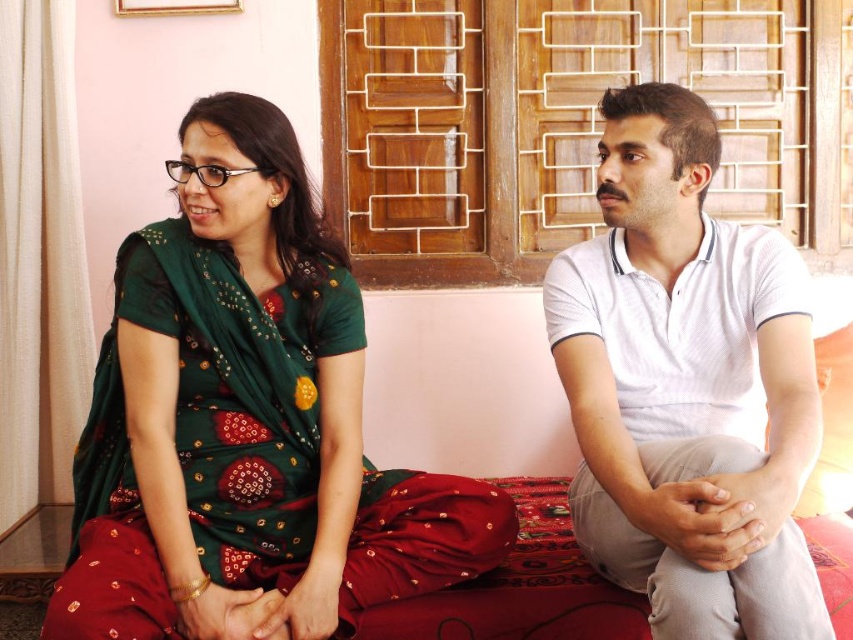
Two people are sitting on a red sofa. The woman is wearing a green blouse and red skirt, and the man is in a white polo shirt. They are separated by a point at coordinates point (119,282). If the sofa is 2 meters long, can both of them sit comfortably without overlapping each other?

The two people are 1.54 meters apart, so they can sit comfortably on a 2 meter long sofa without overlapping since the distance between them is less than the sofa length.

You are standing in the living room and see the green embroidered saree at left and the white cotton shirt at center. Which clothing item is positioned farther to the left?

The green embroidered saree at left is positioned farther to the left than the white cotton shirt at center.

You are standing in front of the sofa where the two people are sitting. You want to place a small plant on the sofa. The plant needs to be placed closer to you than the edge of the sofa. Which of the two points, point (308,602) or point (746,470), should you choose?

You should choose point (308,602) because it is closer to you than point (746,470), ensuring the plant is placed closer to you than the edge of the sofa.